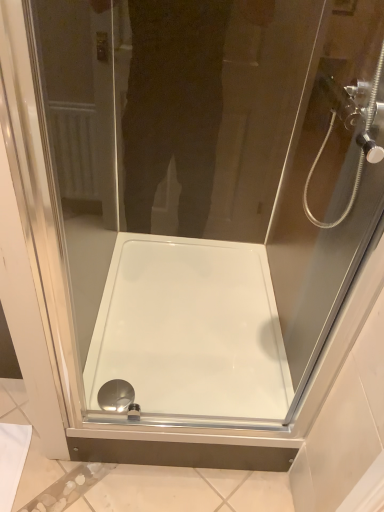
Image resolution: width=384 pixels, height=512 pixels. What do you see at coordinates (325, 179) in the screenshot?
I see `transparent glass shower head at upper right` at bounding box center [325, 179].

Where is `white glossy bath at center`? white glossy bath at center is located at coordinates coord(191,330).

At what (x,y) coordinates should I click in order to perform the action: click on polished chrome drain at bottom center. Please return your answer as a coordinate pair (x, y). This screenshot has width=384, height=512. Looking at the image, I should click on (118, 398).

Does polished chrome drain at bottom center touch white glossy bath at center?

No, polished chrome drain at bottom center is not in contact with white glossy bath at center.

From the image's perspective, is polished chrome drain at bottom center positioned above or below white glossy bath at center?

Based on their image positions, polished chrome drain at bottom center is located beneath white glossy bath at center.

Considering the relative positions of polished chrome drain at bottom center and white glossy bath at center in the image provided, is polished chrome drain at bottom center to the left or to the right of white glossy bath at center?

From the image, it's evident that polished chrome drain at bottom center is to the left of white glossy bath at center.

Who is bigger, polished chrome drain at bottom center or white glossy bath at center?

Bigger between the two is white glossy bath at center.

Does white glossy bath at center have a smaller size compared to transparent glass shower head at upper right?

No.

Can transparent glass shower head at upper right be found inside white glossy bath at center?

Definitely not — transparent glass shower head at upper right is not inside white glossy bath at center.

Are white glossy bath at center and transparent glass shower head at upper right making contact?

No, white glossy bath at center is not beside transparent glass shower head at upper right.

Is point (196, 358) positioned behind point (340, 18)?

Yes, it is behind point (340, 18).

From the image's perspective, which object appears higher, transparent glass shower head at upper right or polished chrome drain at bottom center?

transparent glass shower head at upper right.

Considering the sizes of transparent glass shower head at upper right and polished chrome drain at bottom center in the image, is transparent glass shower head at upper right taller or shorter than polished chrome drain at bottom center?

In the image, transparent glass shower head at upper right appears to be taller than polished chrome drain at bottom center.

Visually, is transparent glass shower head at upper right positioned to the left or to the right of polished chrome drain at bottom center?

Clearly, transparent glass shower head at upper right is on the right of polished chrome drain at bottom center in the image.

Is polished chrome drain at bottom center a part of transparent glass shower head at upper right?

Actually, polished chrome drain at bottom center is outside transparent glass shower head at upper right.

What's the angular difference between transparent glass shower head at upper right and white glossy bath at center's facing directions?

The angle between the facing direction of transparent glass shower head at upper right and the facing direction of white glossy bath at center is 88.1 degrees.

Considering the sizes of objects transparent glass shower head at upper right and white glossy bath at center in the image provided, who is bigger, transparent glass shower head at upper right or white glossy bath at center?

Bigger between the two is white glossy bath at center.

Who is shorter, transparent glass shower head at upper right or white glossy bath at center?

white glossy bath at center.

Is white glossy bath at center not close to polished chrome drain at bottom center?

No, white glossy bath at center is not far from polished chrome drain at bottom center.

Considering the positions of points (184, 362) and (113, 386), is point (184, 362) farther from camera compared to point (113, 386)?

Yes, it is behind point (113, 386).

Which object is closer to the camera taking this photo, white glossy bath at center or polished chrome drain at bottom center?

Positioned in front is white glossy bath at center.

Measure the distance from white glossy bath at center to polished chrome drain at bottom center.

The distance of white glossy bath at center from polished chrome drain at bottom center is 14.17 inches.

Considering the sizes of objects polished chrome drain at bottom center and transparent glass shower head at upper right in the image provided, who is shorter, polished chrome drain at bottom center or transparent glass shower head at upper right?

Standing shorter between the two is polished chrome drain at bottom center.

From the image's perspective, is polished chrome drain at bottom center positioned above or below transparent glass shower head at upper right?

Clearly, from the image's perspective, polished chrome drain at bottom center is below transparent glass shower head at upper right.

Does polished chrome drain at bottom center have a smaller size compared to transparent glass shower head at upper right?

Correct, polished chrome drain at bottom center occupies less space than transparent glass shower head at upper right.

Can you confirm if polished chrome drain at bottom center is thinner than transparent glass shower head at upper right?

Yes, polished chrome drain at bottom center is thinner than transparent glass shower head at upper right.

In the image, there is a white glossy bath at center. What are the coordinates of `shower below it (from the image's perspective)` in the screenshot? It's located at (118, 398).

The height and width of the screenshot is (512, 384). Find the location of `bath that appears below the transparent glass shower head at upper right (from a real-world perspective)`. bath that appears below the transparent glass shower head at upper right (from a real-world perspective) is located at coordinates (191, 330).

Which object lies further to the anchor point white glossy bath at center, transparent glass shower head at upper right or polished chrome drain at bottom center?

transparent glass shower head at upper right.

Looking at the image, which one is located closer to polished chrome drain at bottom center, white glossy bath at center or transparent glass shower head at upper right?

white glossy bath at center lies closer to polished chrome drain at bottom center than the other object.

When comparing their distances from transparent glass shower head at upper right, does polished chrome drain at bottom center or white glossy bath at center seem further?

polished chrome drain at bottom center is positioned further to the anchor transparent glass shower head at upper right.

When comparing their distances from polished chrome drain at bottom center, does transparent glass shower head at upper right or white glossy bath at center seem closer?

white glossy bath at center is closer to polished chrome drain at bottom center.

When comparing their distances from white glossy bath at center, does polished chrome drain at bottom center or transparent glass shower head at upper right seem closer?

polished chrome drain at bottom center lies closer to white glossy bath at center than the other object.

When comparing their distances from transparent glass shower head at upper right, does white glossy bath at center or polished chrome drain at bottom center seem further?

polished chrome drain at bottom center is further to transparent glass shower head at upper right.

Where is `bath between transparent glass shower head at upper right and polished chrome drain at bottom center from top to bottom`? bath between transparent glass shower head at upper right and polished chrome drain at bottom center from top to bottom is located at coordinates (191, 330).